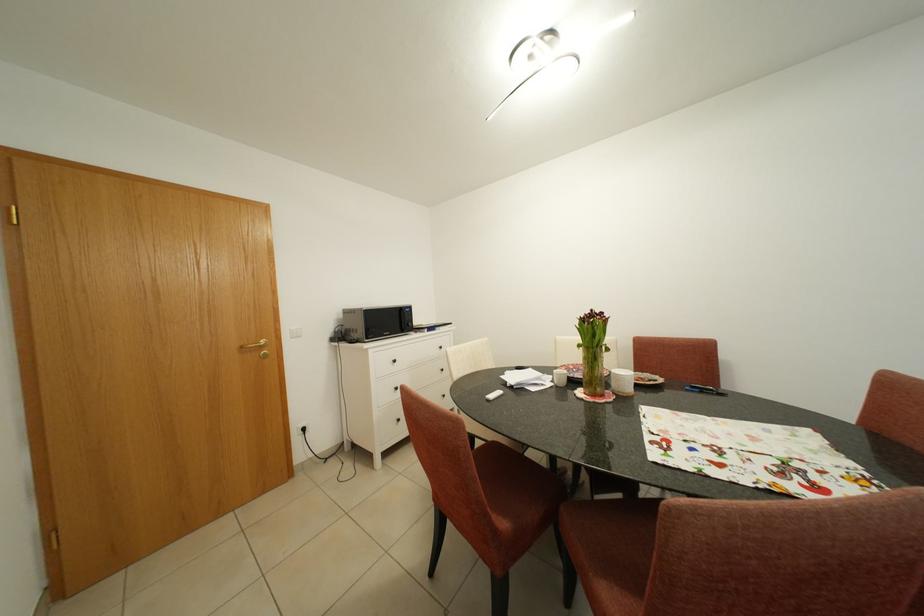
You are a GUI agent. You are given a task and a screenshot of the screen. Output one action in this format:
    pyautogui.click(x=<x>, y=<y>)
    Task: Click on the black power plug
    The width and height of the screenshot is (924, 616).
    Given the screenshot: What is the action you would take?
    pyautogui.click(x=302, y=429)